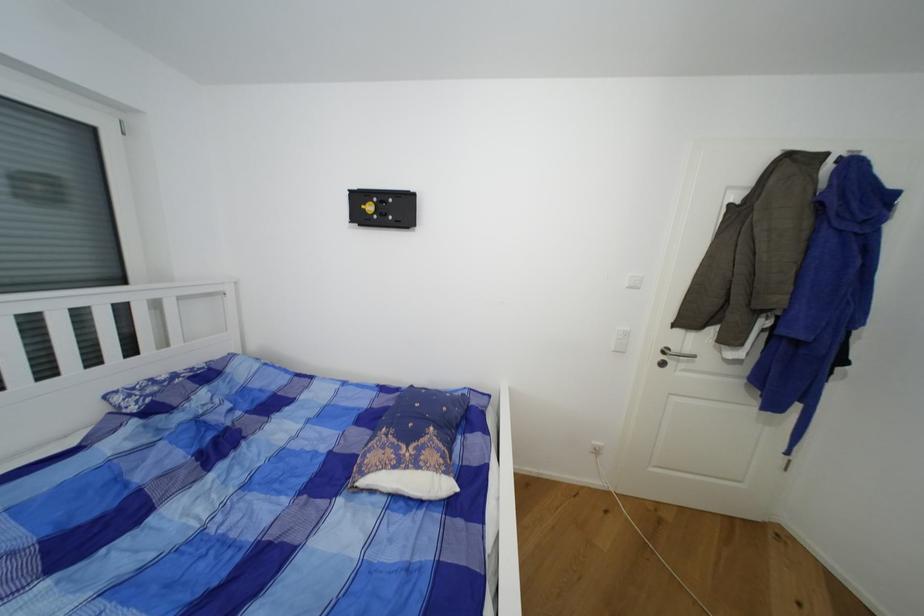
Where is `blue patterned pillow`? blue patterned pillow is located at coordinates (412, 446).